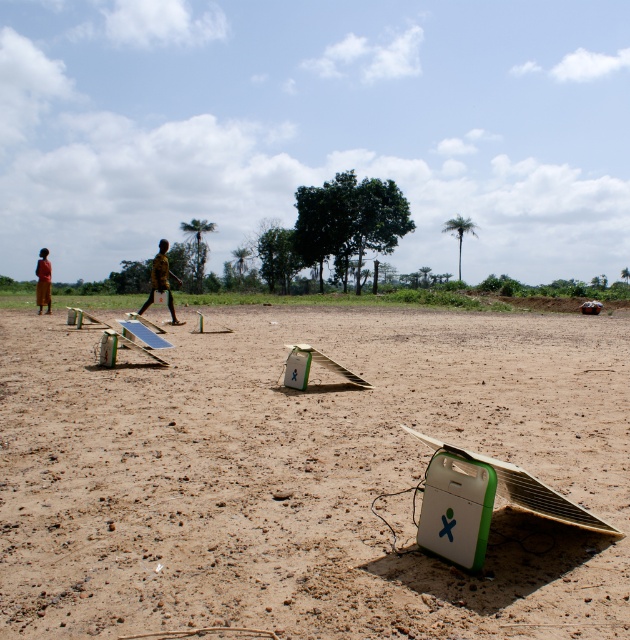
You are a photographer standing at the far end of the sandy terrain. You want to take a photo of the yellow matte shirt at center and the red fabric person at left. Based on their sizes in the image, which one would appear smaller in the photo?

The yellow matte shirt at center would appear smaller in the photo because it has a lesser width compared to the red fabric person at left.

You are standing at the point marked by the coordinates point [161,280] in the image. Looking around, you see solar devices with white panels and green accents spread across the sandy terrain. Which direction should you walk to reach the person wearing the yellow patterned shirt?

The point [161,280] indicates the yellow matte shirt at center, so you are already at the location of the person wearing the yellow patterned shirt.

You are standing on the brown sandy dirt at center and want to approach the red fabric person at left. Which direction should you move to reach them?

The brown sandy dirt at center is below the red fabric person at left, so you should move upward to reach them.